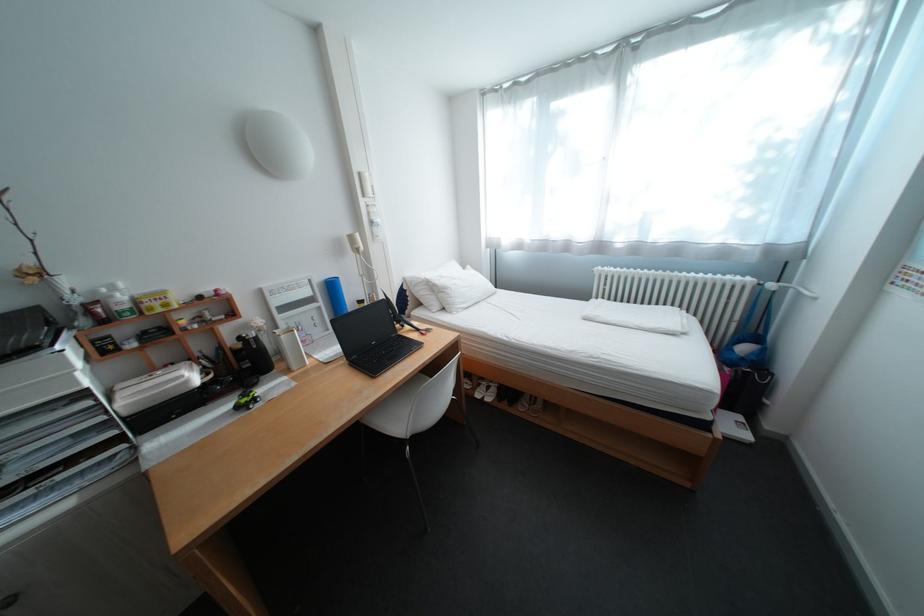
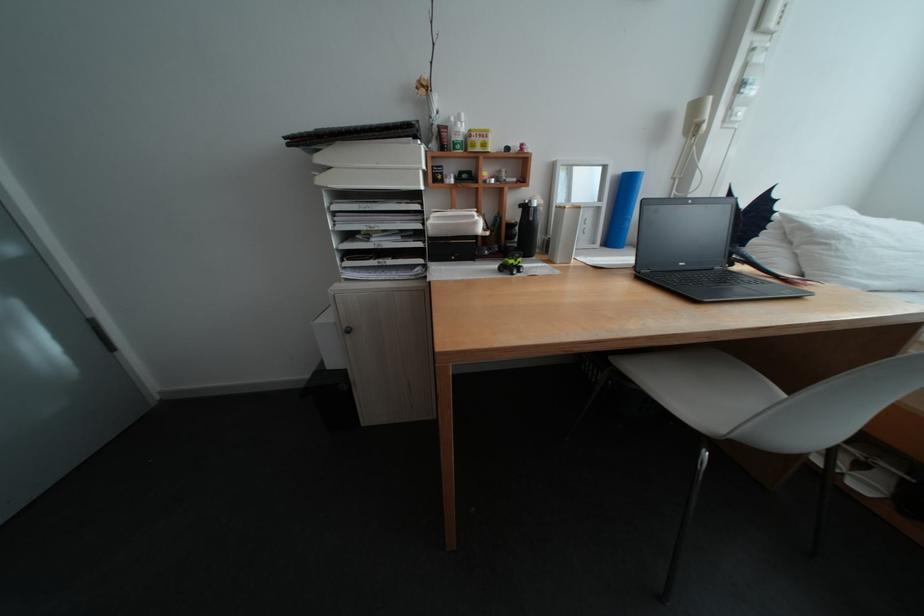
Find the pixel in the second image that matches point (334, 304) in the first image.

(616, 205)